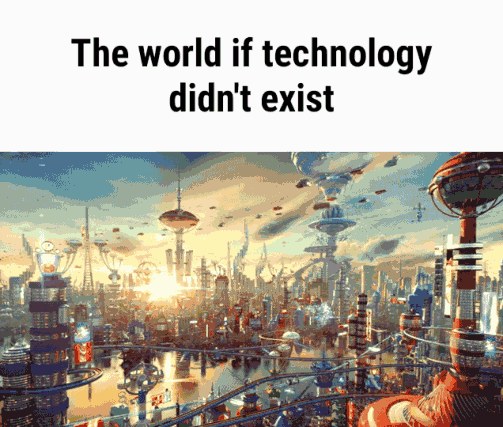
The image size is (503, 427). Find the location of `elevator`. elevator is located at coordinates (245, 298), (82, 347).